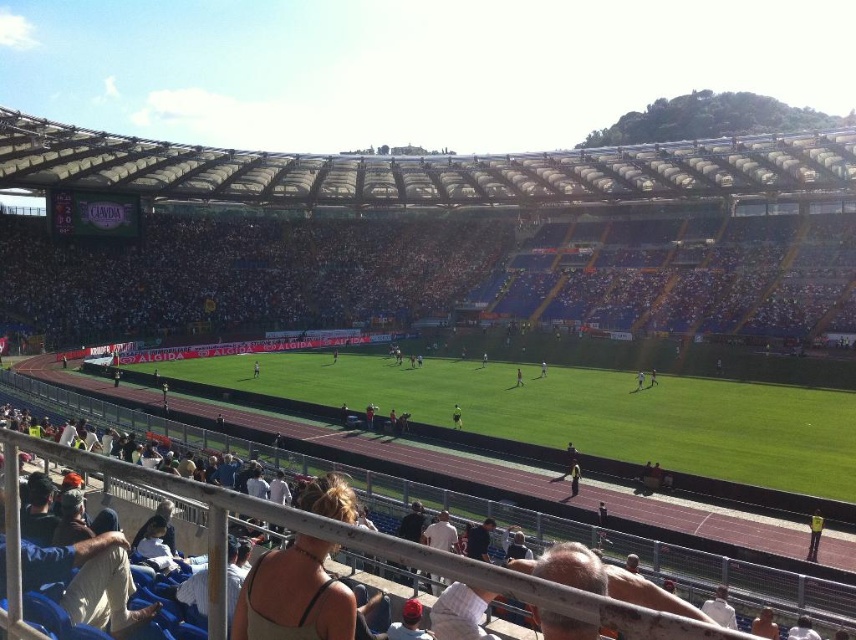
Is beige fabric tank top at lower center bigger than white fabric person at center?

No, beige fabric tank top at lower center is not bigger than white fabric person at center.

Is beige fabric tank top at lower center taller than white fabric person at center?

Incorrect, beige fabric tank top at lower center's height is not larger of white fabric person at center's.

Between point (340, 477) and point (541, 364), which one is positioned behind?

The point (541, 364) is more distant.

The height and width of the screenshot is (640, 856). I want to click on beige fabric tank top at lower center, so click(294, 595).

This screenshot has width=856, height=640. What do you see at coordinates (294, 595) in the screenshot?
I see `beige fabric tank top at lower center` at bounding box center [294, 595].

Find the location of a particular element. This screenshot has width=856, height=640. beige fabric tank top at lower center is located at coordinates (294, 595).

Does beige fabric tank top at lower center appear over dark gray track at lower center?

Indeed, beige fabric tank top at lower center is positioned over dark gray track at lower center.

Does beige fabric tank top at lower center appear on the right side of dark gray track at lower center?

No, beige fabric tank top at lower center is not to the right of dark gray track at lower center.

Who is more distant from viewer, (349, 516) or (569, 493)?

Positioned behind is point (569, 493).

You are a GUI agent. You are given a task and a screenshot of the screen. Output one action in this format:
    pyautogui.click(x=<x>, y=<y>)
    Task: Click on the beige fabric tank top at lower center
    
    Given the screenshot: What is the action you would take?
    pyautogui.click(x=294, y=595)